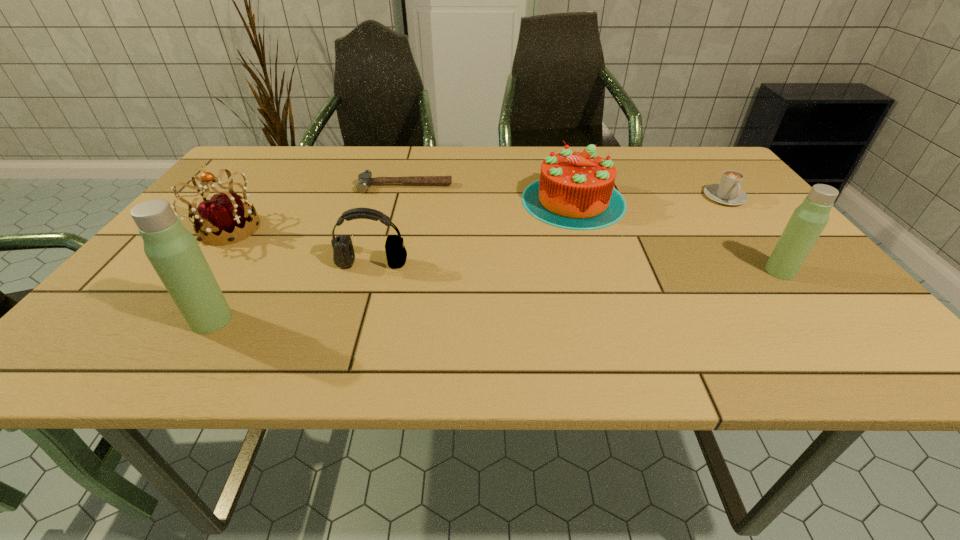
What are the coordinates of `free location that satisfies the following two spatial constraints: 1. on the striking face of the hammer; 2. on the left side of the fifth object from left to right` in the screenshot? It's located at (402, 200).